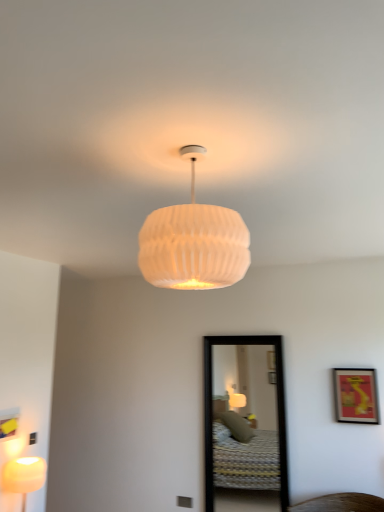
Question: Which direction should I rotate to look at white ribbed shade at center, positioned as the 2th lamp in left-to-right order, — up or down?

Choices:
 (A) down
 (B) up

Answer: (B)

Question: From the image's perspective, is white ribbed shade at center, positioned as the 2th lamp in left-to-right order, beneath matte white lamp at lower left, which is the 1th lamp from left to right?

Choices:
 (A) no
 (B) yes

Answer: (A)

Question: Is white ribbed shade at center, which appears as the 1th lamp when viewed from the front, positioned with its back to matte white lamp at lower left, positioned as the second lamp in top-to-bottom order?

Choices:
 (A) yes
 (B) no

Answer: (B)

Question: From a real-world perspective, does white ribbed shade at center, positioned as the 2th lamp in left-to-right order, sit lower than matte white lamp at lower left, which is the 1th lamp from left to right?

Choices:
 (A) yes
 (B) no

Answer: (B)

Question: Considering the relative positions of white ribbed shade at center, the 1th lamp when ordered from right to left, and matte white lamp at lower left, positioned as the second lamp in top-to-bottom order, in the image provided, is white ribbed shade at center, the 1th lamp when ordered from right to left, behind matte white lamp at lower left, positioned as the second lamp in top-to-bottom order,?

Choices:
 (A) no
 (B) yes

Answer: (A)

Question: Can you confirm if white ribbed shade at center, the 1th lamp when ordered from right to left, is shorter than matte white lamp at lower left, which appears as the 1th lamp when ordered from the bottom?

Choices:
 (A) yes
 (B) no

Answer: (B)

Question: Considering the relative sizes of white ribbed shade at center, which is counted as the second lamp, starting from the bottom, and matte white lamp at lower left, the 2th lamp when ordered from right to left, in the image provided, is white ribbed shade at center, which is counted as the second lamp, starting from the bottom, smaller than matte white lamp at lower left, the 2th lamp when ordered from right to left,?

Choices:
 (A) yes
 (B) no

Answer: (B)

Question: Would you say matte red picture frame at right is a long distance from matte white lamp at lower left, marked as the 1th lamp in a back-to-front arrangement?

Choices:
 (A) no
 (B) yes

Answer: (B)

Question: Does matte red picture frame at right turn towards matte white lamp at lower left, marked as the 1th lamp in a back-to-front arrangement?

Choices:
 (A) no
 (B) yes

Answer: (A)

Question: Is matte white lamp at lower left, marked as the 1th lamp in a back-to-front arrangement, at the back of matte red picture frame at right?

Choices:
 (A) yes
 (B) no

Answer: (B)

Question: Could matte white lamp at lower left, which appears as the 1th lamp when ordered from the bottom, be considered to be inside matte red picture frame at right?

Choices:
 (A) yes
 (B) no

Answer: (B)

Question: From the image's perspective, is matte red picture frame at right below matte white lamp at lower left, positioned as the second lamp in top-to-bottom order?

Choices:
 (A) no
 (B) yes

Answer: (A)

Question: Does matte red picture frame at right have a larger size compared to matte white lamp at lower left, positioned as the second lamp in top-to-bottom order?

Choices:
 (A) no
 (B) yes

Answer: (A)

Question: Is black-framed mirror at center far from matte white lamp at lower left, the 2th lamp when ordered from right to left?

Choices:
 (A) yes
 (B) no

Answer: (A)